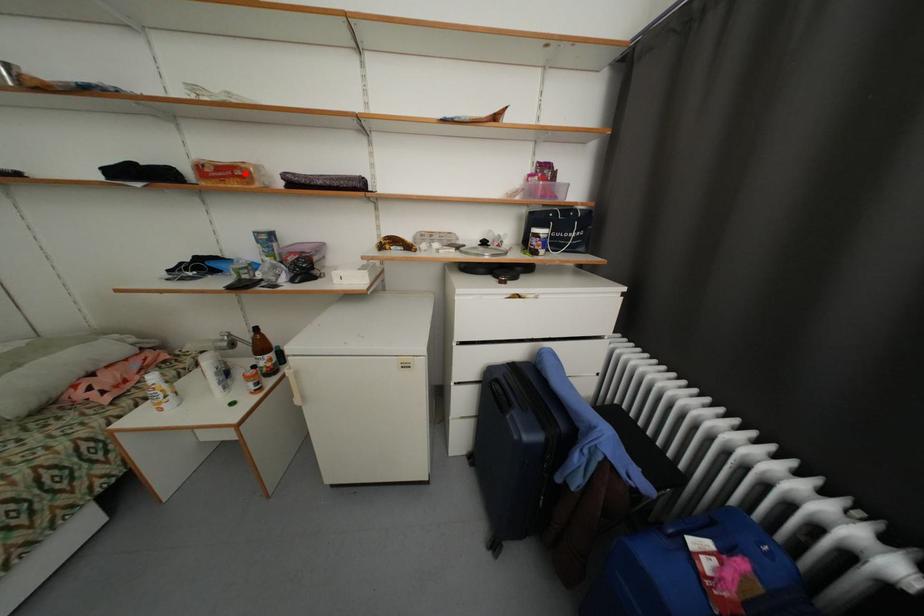
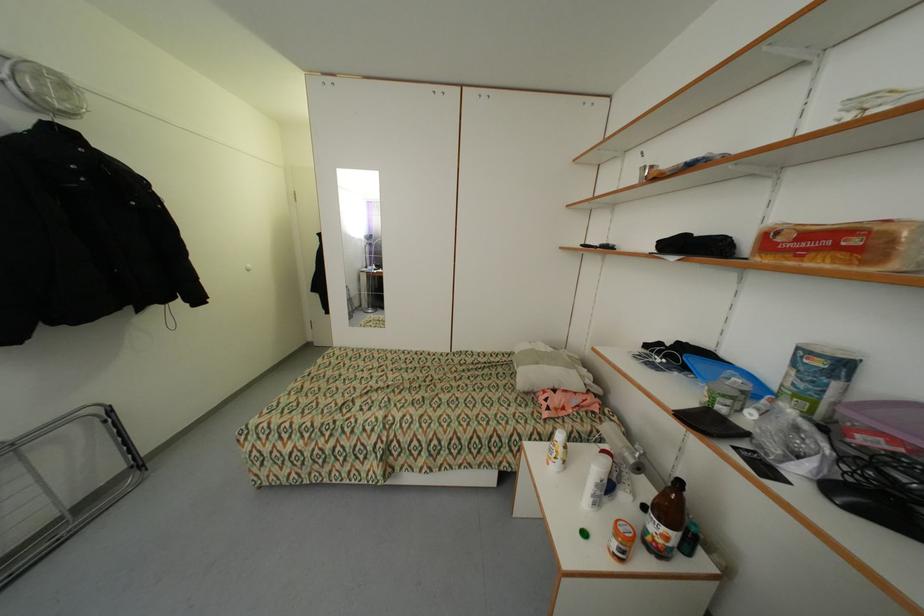
Locate, in the second image, the point that corresponds to the highlighted location in the first image.

(860, 241)